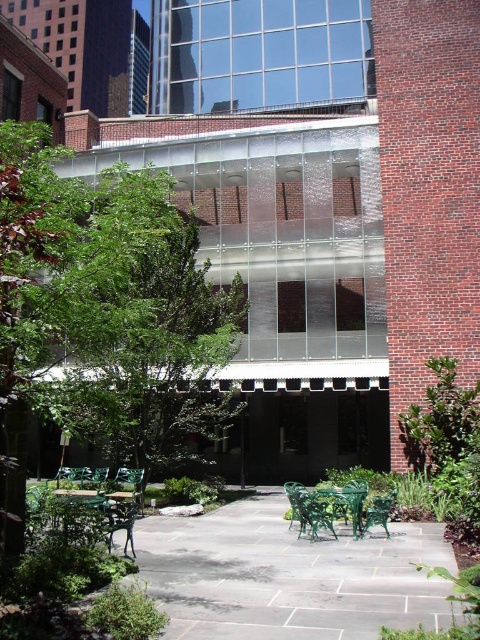
Does green leafy tree at center have a greater width compared to green metal table at lower left?

No, green leafy tree at center is not wider than green metal table at lower left.

Can you confirm if green leafy tree at center is positioned to the left of green metal table at lower left?

Indeed, green leafy tree at center is positioned on the left side of green metal table at lower left.

Is point (56, 189) positioned after point (269, 566)?

That is False.

Find the location of a particular element. Image resolution: width=480 pixels, height=640 pixels. green leafy tree at center is located at coordinates (108, 301).

Is green metal table at lower left below green metal park bench at center?

Indeed, green metal table at lower left is positioned under green metal park bench at center.

This screenshot has width=480, height=640. What do you see at coordinates (288, 576) in the screenshot? I see `green metal table at lower left` at bounding box center [288, 576].

At what (x,y) coordinates should I click in order to perform the action: click on green metal table at lower left. Please return your answer as a coordinate pair (x, y). The width and height of the screenshot is (480, 640). Looking at the image, I should click on (288, 576).

Which is below, green leafy tree at center or green metal park bench at center?

green metal park bench at center

Between green leafy tree at center and green metal park bench at center, which one has more height?

With more height is green leafy tree at center.

Between point (106, 348) and point (363, 522), which one is positioned behind?

The point (363, 522) is more distant.

The height and width of the screenshot is (640, 480). In order to click on green leafy tree at center in this screenshot , I will do `click(108, 301)`.